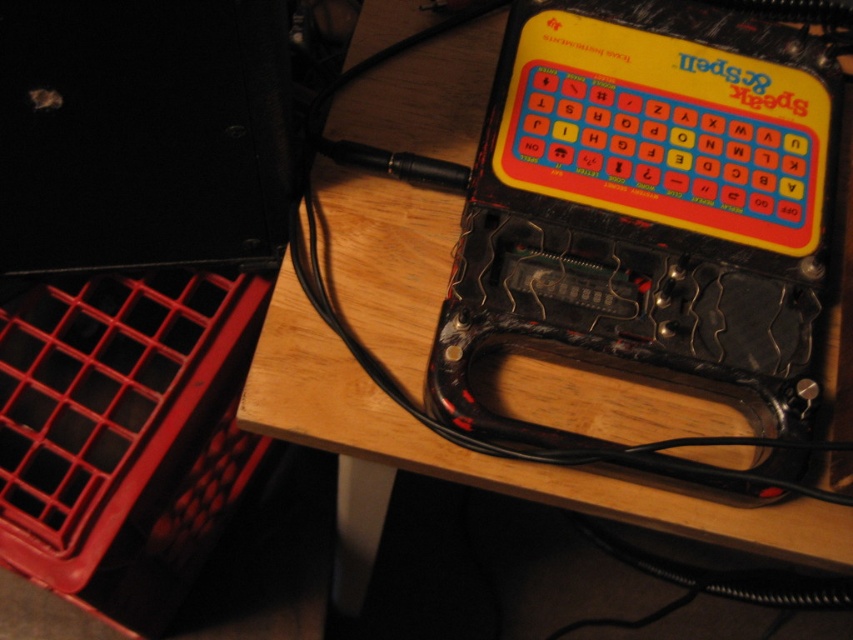
Does wooden table at upper center lie in front of red plastic crate at lower left?

Yes, it is.

Is wooden table at upper center behind red plastic crate at lower left?

No.

Who is more forward, (x=329, y=168) or (x=51, y=458)?

Point (x=329, y=168)

The image size is (853, 640). Find the location of `wooden table at upper center`. wooden table at upper center is located at coordinates (480, 458).